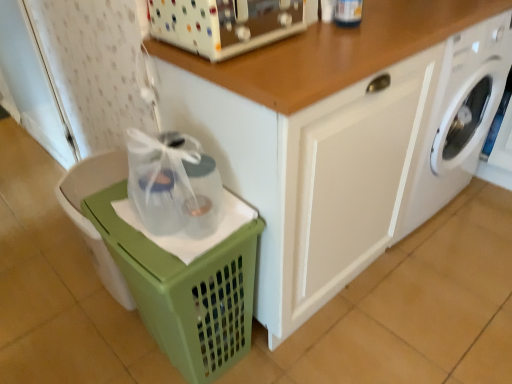
Question: Is white plastic toaster at upper center inside or outside of green plastic basket at lower left?

Choices:
 (A) inside
 (B) outside

Answer: (B)

Question: Based on their sizes in the image, would you say white plastic toaster at upper center is bigger or smaller than green plastic basket at lower left?

Choices:
 (A) small
 (B) big

Answer: (A)

Question: Which of these objects is positioned farthest from the white glossy cabinet at center?

Choices:
 (A) white textured screen door at left
 (B) green plastic basket at lower left
 (C) green plastic basket at lower left
 (D) white glossy washing machine at lower right
 (E) white plastic toaster at upper center

Answer: (A)

Question: Estimate the real-world distances between objects in this image. Which object is closer to the white textured screen door at left?

Choices:
 (A) white plastic toaster at upper center
 (B) white glossy cabinet at center
 (C) green plastic basket at lower left
 (D) white glossy washing machine at lower right
 (E) green plastic basket at lower left

Answer: (C)